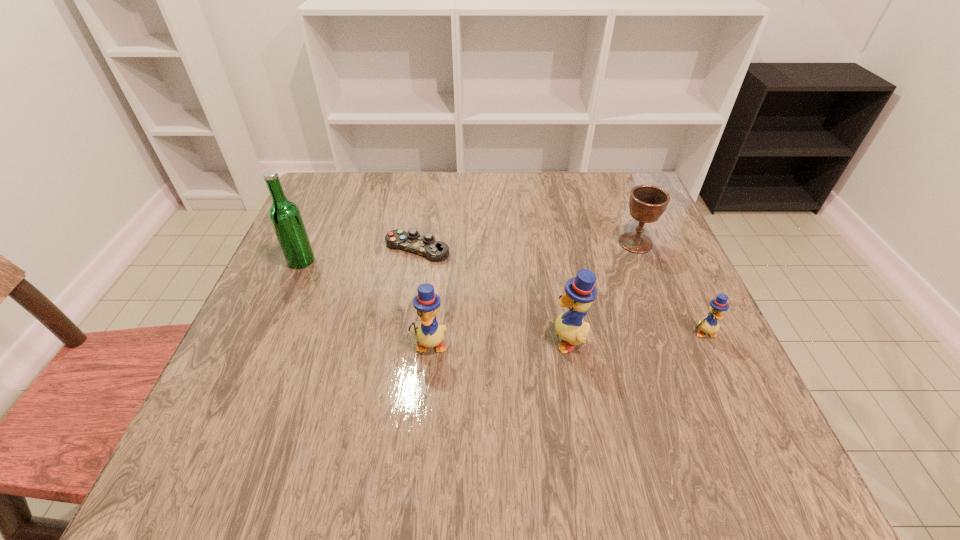
At what (x,y) coordinates should I click in order to perform the action: click on free location located on the face of the second duckling from left to right, where the monocle is placed. Please return your answer as a coordinate pair (x, y). The height and width of the screenshot is (540, 960). Looking at the image, I should click on (380, 339).

You are a GUI agent. You are given a task and a screenshot of the screen. Output one action in this format:
    pyautogui.click(x=<x>, y=<y>)
    Task: Click on the free region located 0.390m on the face of the second duckling from left to right, where the monocle is placed
    
    Given the screenshot: What is the action you would take?
    pyautogui.click(x=349, y=339)

At what (x,y) coordinates should I click in order to perform the action: click on vacant space located 0.090m on the face of the fifth tallest object, where the monocle is placed. Please return your answer as a coordinate pair (x, y). The width and height of the screenshot is (960, 540). Looking at the image, I should click on (727, 381).

At what (x,y) coordinates should I click in order to perform the action: click on vacant space located 0.170m on the left of the control. Please return your answer as a coordinate pair (x, y). Looking at the image, I should click on (313, 249).

Identify the location of vacant space situated on the left of the chalice. The image size is (960, 540). (489, 243).

You are a GUI agent. You are given a task and a screenshot of the screen. Output one action in this format:
    pyautogui.click(x=<x>, y=<y>)
    Task: Click on the free space located on the front of the beer bottle
    The width and height of the screenshot is (960, 540).
    Given the screenshot: What is the action you would take?
    pyautogui.click(x=281, y=306)

The width and height of the screenshot is (960, 540). What are the coordinates of `object that is at the left edge` in the screenshot? It's located at (285, 217).

At what (x,y) coordinates should I click in order to perform the action: click on duckling that is at the right edge. Please return your answer as a coordinate pair (x, y). This screenshot has width=960, height=540. Looking at the image, I should click on (709, 324).

Image resolution: width=960 pixels, height=540 pixels. I want to click on chalice that is at the right edge, so click(x=647, y=203).

The image size is (960, 540). I want to click on vacant region at the far edge of the desktop, so click(x=476, y=204).